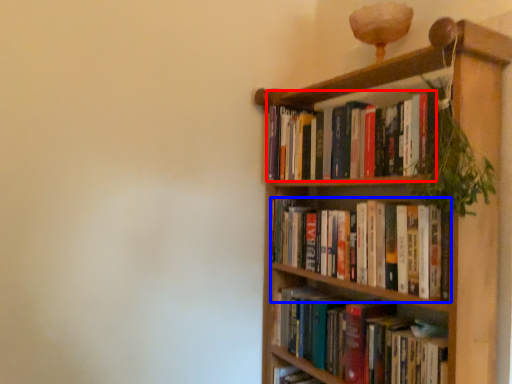
Question: Which point is further to the camera, book (highlighted by a red box) or book (highlighted by a blue box)?

Choices:
 (A) book
 (B) book

Answer: (A)